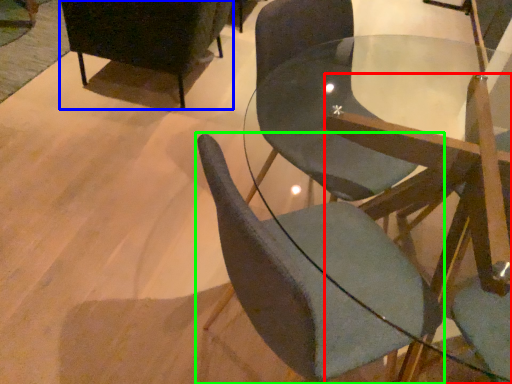
Question: Which object is the closest to the chair (highlighted by a red box)? Choose among these: chair (highlighted by a blue box) or chair (highlighted by a green box).

Choices:
 (A) chair
 (B) chair

Answer: (B)